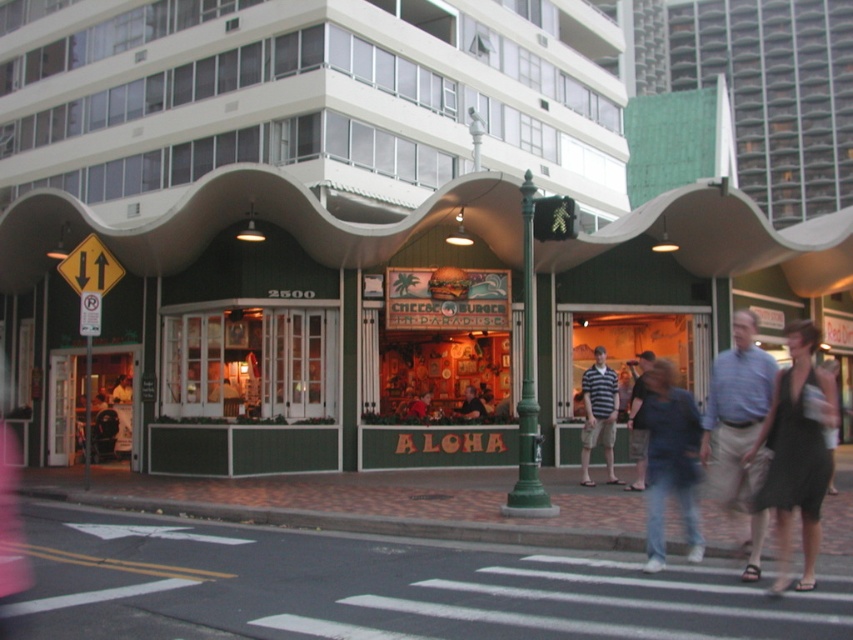
Can you confirm if denim jeans at lower right is positioned to the left of green metal pole at center?

Indeed, denim jeans at lower right is positioned on the left side of green metal pole at center.

Who is higher up, denim jeans at lower right or green metal pole at center?

green metal pole at center is higher up.

Who is more distant from viewer, [650,516] or [532,404]?

The point [532,404] is behind.

Locate an element on the screen. Image resolution: width=853 pixels, height=640 pixels. denim jeans at lower right is located at coordinates (670, 461).

Between point (770, 356) and point (689, 442), which one is positioned behind?

The point (689, 442) is behind.

Can you confirm if blue shirt at center is positioned below denim jeans at lower right?

Actually, blue shirt at center is above denim jeans at lower right.

Which is in front, point (740, 308) or point (659, 506)?

Point (659, 506) is in front.

Identify the location of blue shirt at center. (738, 410).

Is the position of black textured dress at lower right less distant than that of striped cotton shirt at center?

Yes, it is in front of striped cotton shirt at center.

Between black textured dress at lower right and striped cotton shirt at center, which one appears on the left side from the viewer's perspective?

striped cotton shirt at center is more to the left.

Locate an element on the screen. This screenshot has height=640, width=853. black textured dress at lower right is located at coordinates (796, 452).

Identify the location of black textured dress at lower right. (796, 452).